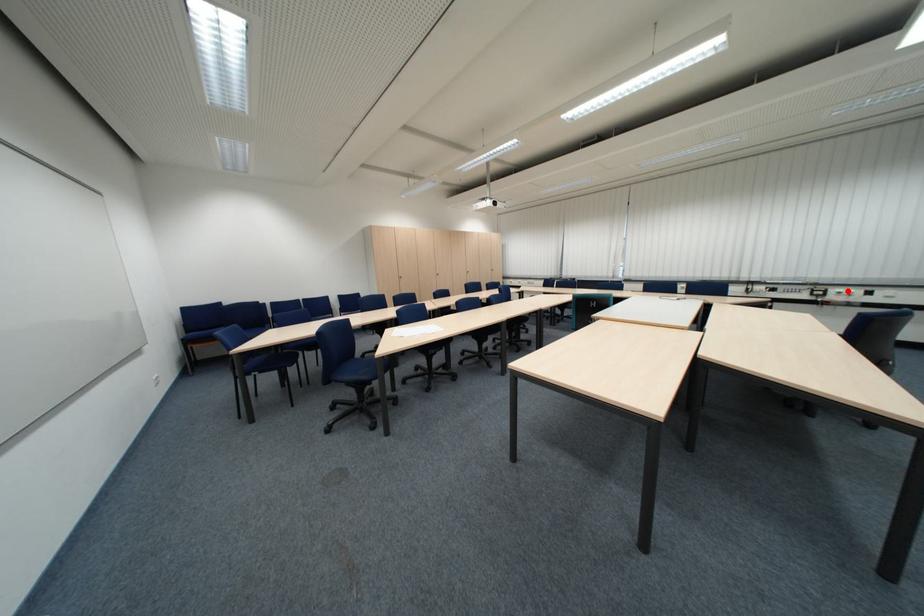
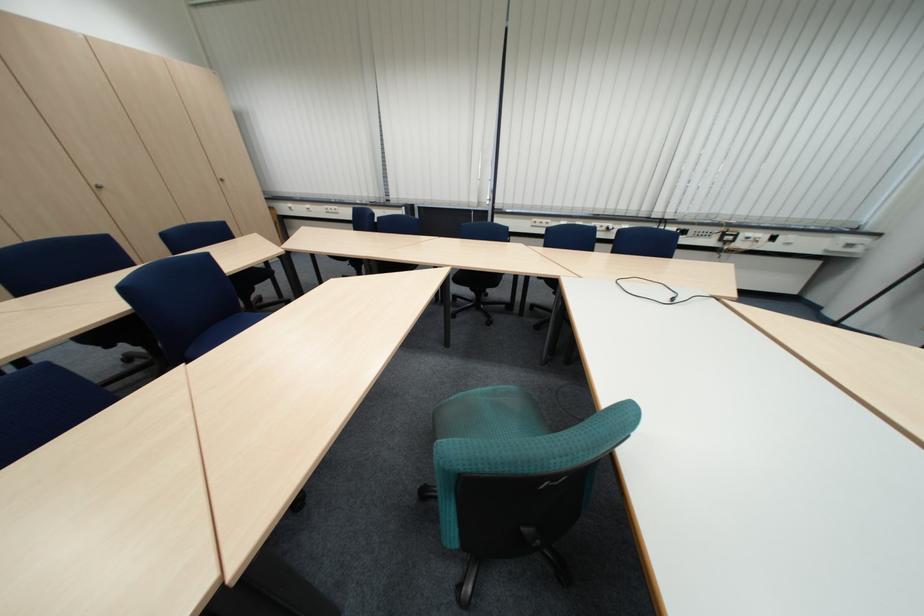
Where in the second image is the point corresponding to the highlighted location from the first image?

(759, 235)